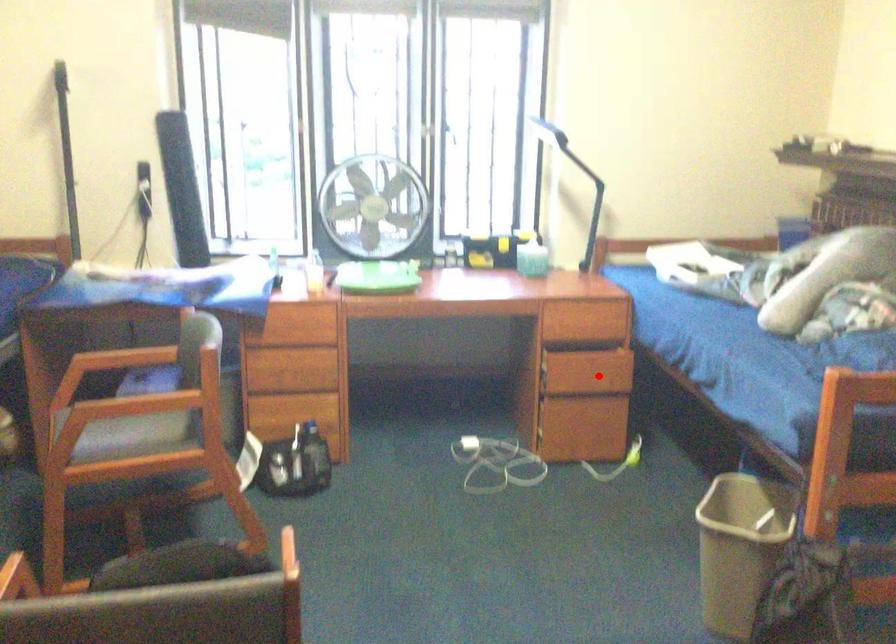
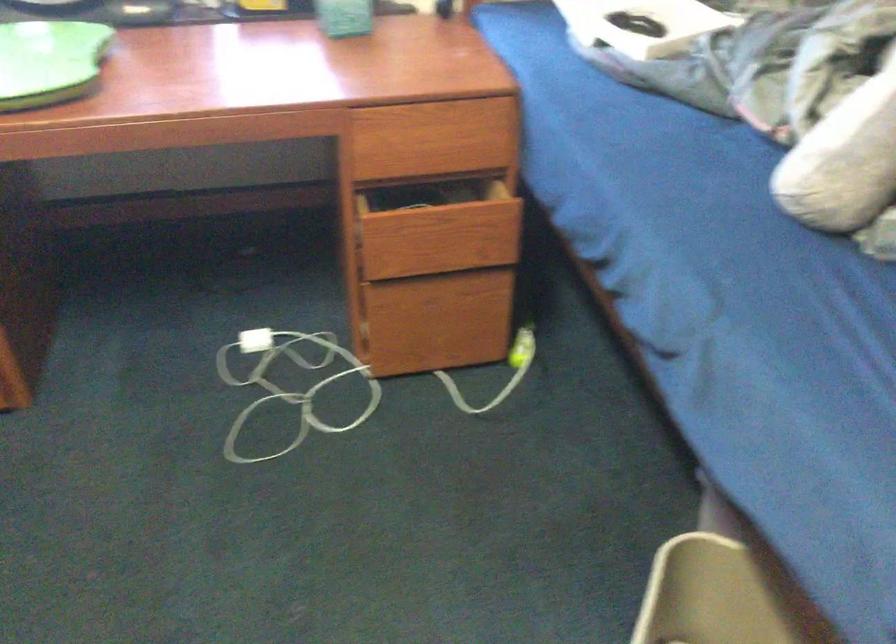
Question: A red point is marked in image1. In image2, is the corresponding 3D point closer to the camera or farther? Reply with the corresponding letter.

Choices:
 (A) The corresponding 3D point is closer.
 (B) The corresponding 3D point is farther.

Answer: (A)